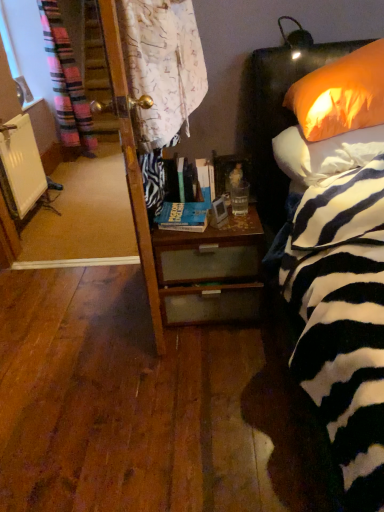
At what (x,y) coordinates should I click in order to perform the action: click on empty space that is ontop of hardcover book at center, the second book positioned from the back (from a real-world perspective). Please return your answer as a coordinate pair (x, y). The height and width of the screenshot is (512, 384). Looking at the image, I should click on (185, 203).